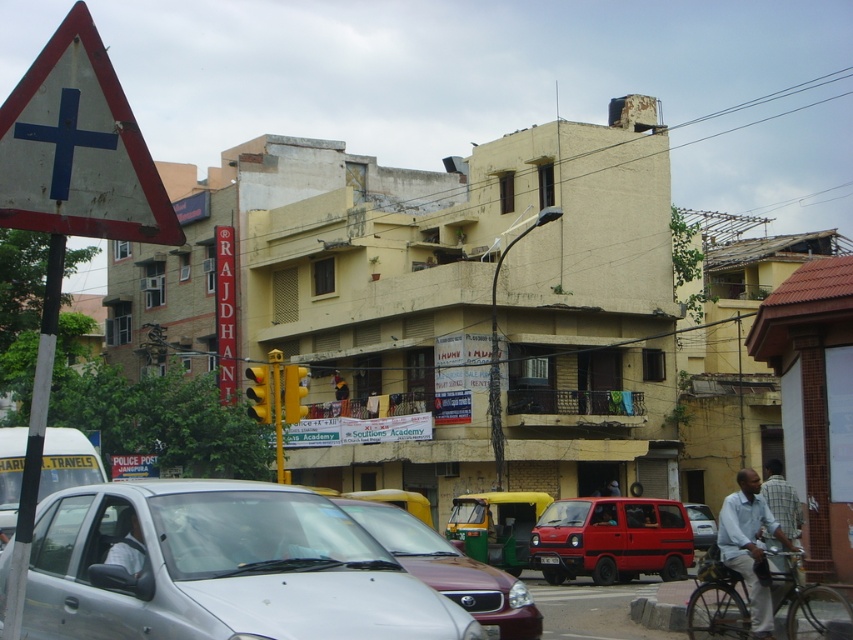
Question: Can you confirm if silver metallic car at center is positioned to the left of red matte van at center?

Choices:
 (A) yes
 (B) no

Answer: (A)

Question: Which of the following is the farthest from the observer?

Choices:
 (A) light blue cotton shirt at lower right
 (B) maroon matte car at center

Answer: (A)

Question: Which object is positioned farthest from the light blue cotton shirt at lower right?

Choices:
 (A) red matte van at center
 (B) maroon matte car at center

Answer: (A)

Question: Is silver metallic car at center closer to the viewer compared to light blue cotton shirt at lower right?

Choices:
 (A) yes
 (B) no

Answer: (A)

Question: Among these objects, which one is farthest from the camera?

Choices:
 (A) matte red van at center
 (B) red matte van at center

Answer: (A)

Question: Can you confirm if silver metallic car at center is bigger than matte red van at center?

Choices:
 (A) yes
 (B) no

Answer: (A)